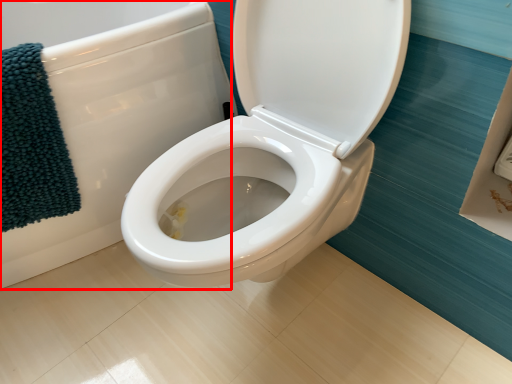
Question: Considering the relative positions of bath (annotated by the red box) and bath towel in the image provided, where is bath (annotated by the red box) located with respect to the staircase?

Choices:
 (A) left
 (B) right

Answer: (A)